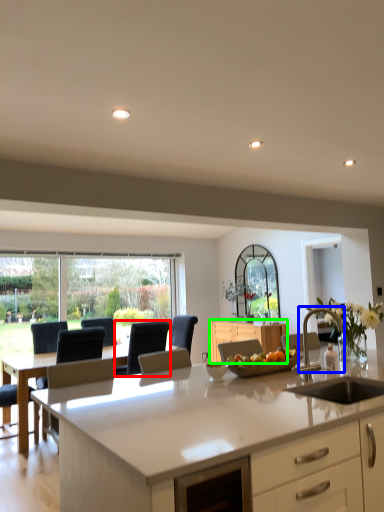
Question: Which object is positioned closest to armchair (highlighted by a red box)? Select from armchair (highlighted by a blue box) and cabinetry (highlighted by a green box).

Choices:
 (A) armchair
 (B) cabinetry

Answer: (B)